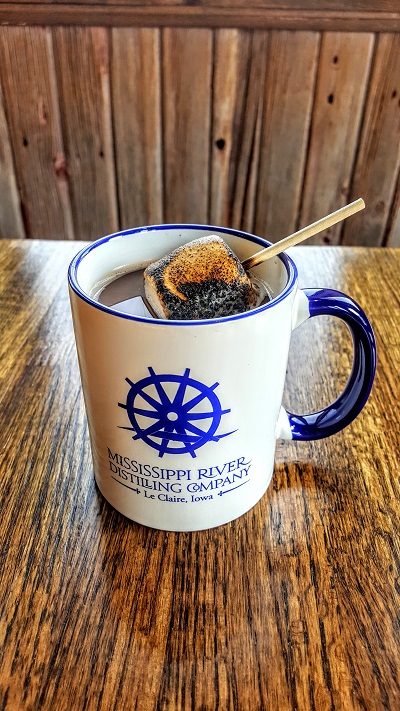
Identify the location of mug. (259, 372).